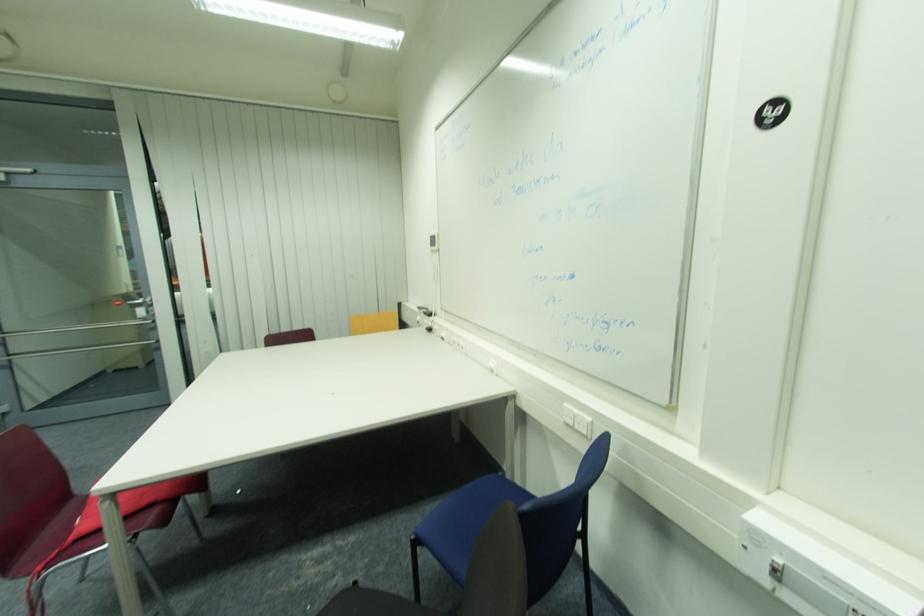
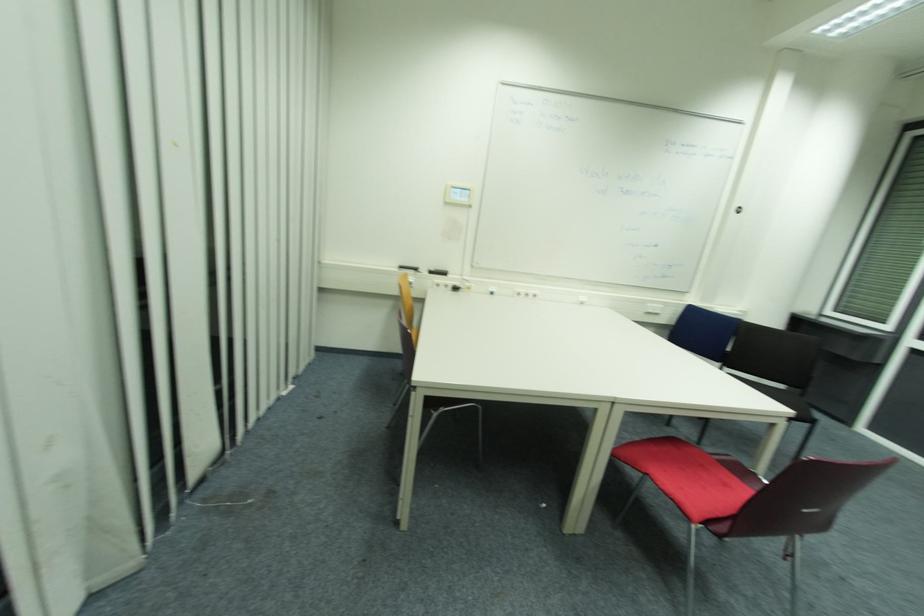
The point at (462, 346) is marked in the first image. Where is the corresponding point in the second image?

(529, 294)